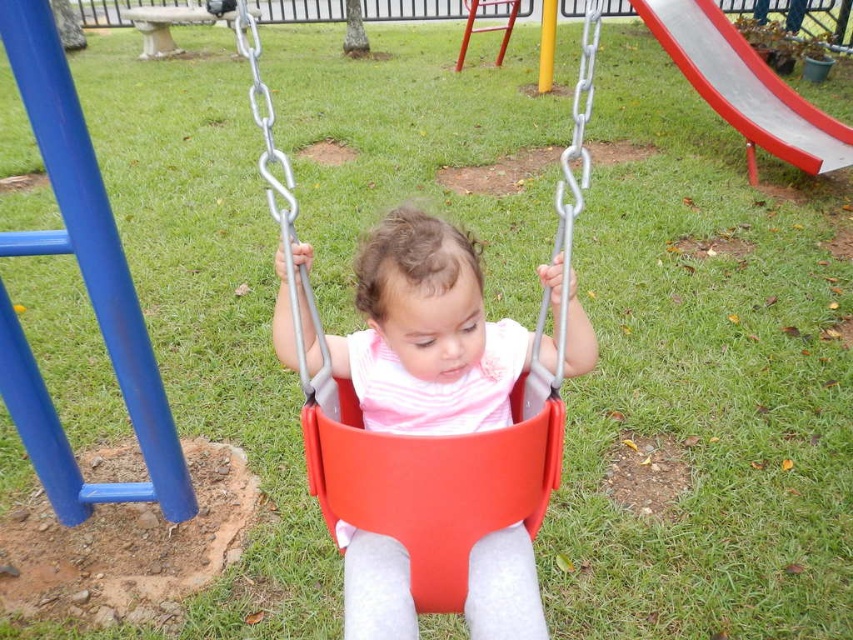
Question: Where is matte plastic swing at center located in relation to smooth plastic slide at upper right in the image?

Choices:
 (A) right
 (B) left

Answer: (B)

Question: Is matte plastic swing at center wider than smooth plastic slide at upper right?

Choices:
 (A) no
 (B) yes

Answer: (A)

Question: Which object is closer to the camera taking this photo?

Choices:
 (A) matte plastic swing at center
 (B) smooth plastic slide at upper right

Answer: (A)

Question: Which point is closer to the camera?

Choices:
 (A) smooth plastic slide at upper right
 (B) matte plastic swing at center

Answer: (B)

Question: Observing the image, what is the correct spatial positioning of matte plastic swing at center in reference to smooth plastic slide at upper right?

Choices:
 (A) left
 (B) right

Answer: (A)